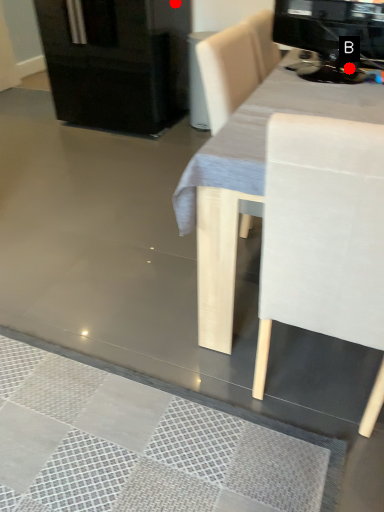
Question: Two points are circled on the image, labeled by A and B beside each circle. Which point appears farthest from the camera in this image?

Choices:
 (A) A is further
 (B) B is further

Answer: (A)